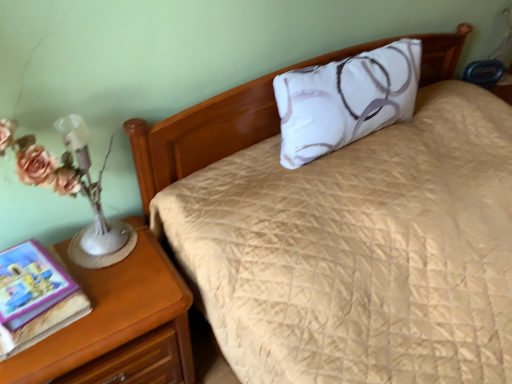
Question: From a real-world perspective, does hardcover book at left stand above white satin pillow at center?

Choices:
 (A) no
 (B) yes

Answer: (A)

Question: Does hardcover book at left have a larger size compared to white satin pillow at center?

Choices:
 (A) no
 (B) yes

Answer: (A)

Question: From the image's perspective, is hardcover book at left over white satin pillow at center?

Choices:
 (A) no
 (B) yes

Answer: (A)

Question: Can white satin pillow at center be found inside hardcover book at left?

Choices:
 (A) no
 (B) yes

Answer: (A)

Question: Is hardcover book at left facing towards white satin pillow at center?

Choices:
 (A) yes
 (B) no

Answer: (B)

Question: Is point [x=31, y=243] closer or farther from the camera than point [x=294, y=114]?

Choices:
 (A) farther
 (B) closer

Answer: (B)

Question: In terms of height, does hardcover book at left look taller or shorter compared to white satin pillow at center?

Choices:
 (A) short
 (B) tall

Answer: (A)

Question: Based on their sizes in the image, would you say hardcover book at left is bigger or smaller than white satin pillow at center?

Choices:
 (A) small
 (B) big

Answer: (A)

Question: From a real-world perspective, is hardcover book at left positioned above or below white satin pillow at center?

Choices:
 (A) above
 (B) below

Answer: (B)

Question: Looking at their shapes, would you say wooden nightstand at lower left is wider or thinner than white satin pillow at center?

Choices:
 (A) wide
 (B) thin

Answer: (A)

Question: From a real-world perspective, relative to white satin pillow at center, is wooden nightstand at lower left vertically above or below?

Choices:
 (A) below
 (B) above

Answer: (A)

Question: From the image's perspective, is wooden nightstand at lower left located above or below white satin pillow at center?

Choices:
 (A) above
 (B) below

Answer: (B)

Question: Is wooden nightstand at lower left taller or shorter than white satin pillow at center?

Choices:
 (A) short
 (B) tall

Answer: (B)

Question: In terms of height, does hardcover book at left look taller or shorter compared to wooden nightstand at lower left?

Choices:
 (A) tall
 (B) short

Answer: (B)

Question: Is point (28, 309) positioned closer to the camera than point (99, 364)?

Choices:
 (A) closer
 (B) farther

Answer: (A)